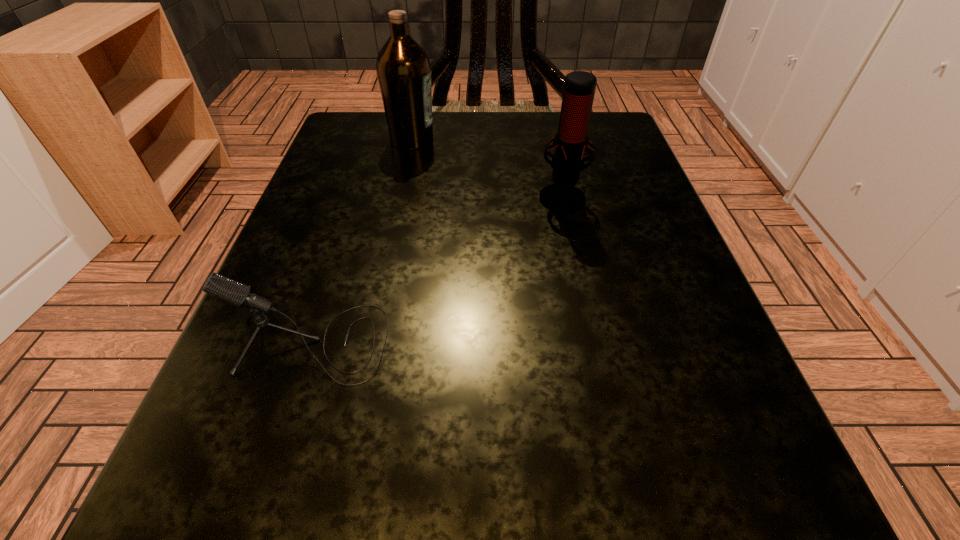
Image resolution: width=960 pixels, height=540 pixels. Identify the location of vacant area that satisfies the following two spatial constraints: 1. on the label of the right microphone; 2. on the left side of the farthest object. (400, 195).

This screenshot has width=960, height=540. I want to click on vacant area in the image that satisfies the following two spatial constraints: 1. on the label of the rightmost object; 2. on the left side of the farthest object, so click(400, 195).

Identify the location of vacant point that satisfies the following two spatial constraints: 1. on the label of the olive oil; 2. on the left side of the farther microphone. (400, 195).

This screenshot has width=960, height=540. What are the coordinates of `vacant region that satisfies the following two spatial constraints: 1. on the label of the olive oil; 2. on the left side of the farther microphone` in the screenshot? It's located at (400, 195).

The width and height of the screenshot is (960, 540). I want to click on free location that satisfies the following two spatial constraints: 1. on the back side of the farther microphone; 2. on the label of the farthest object, so click(x=549, y=139).